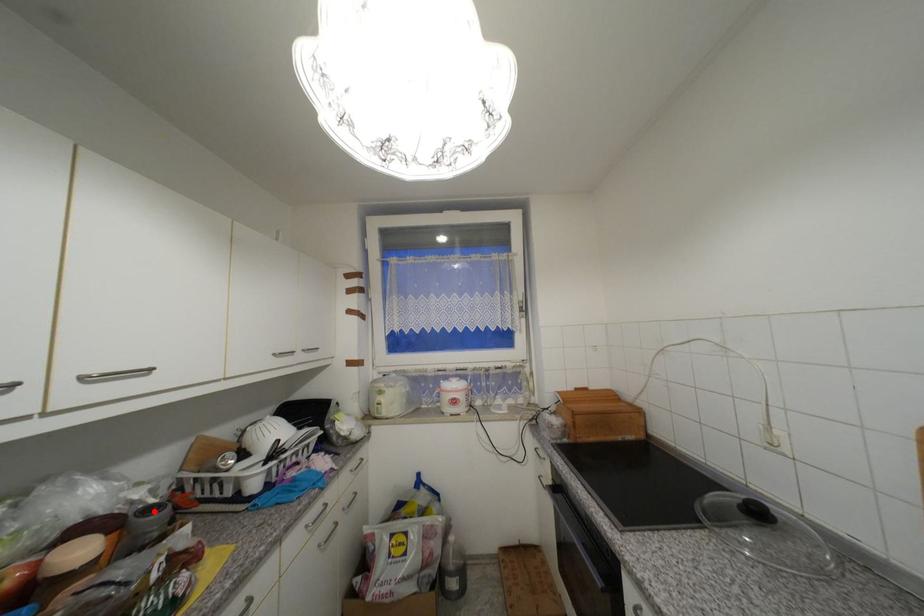
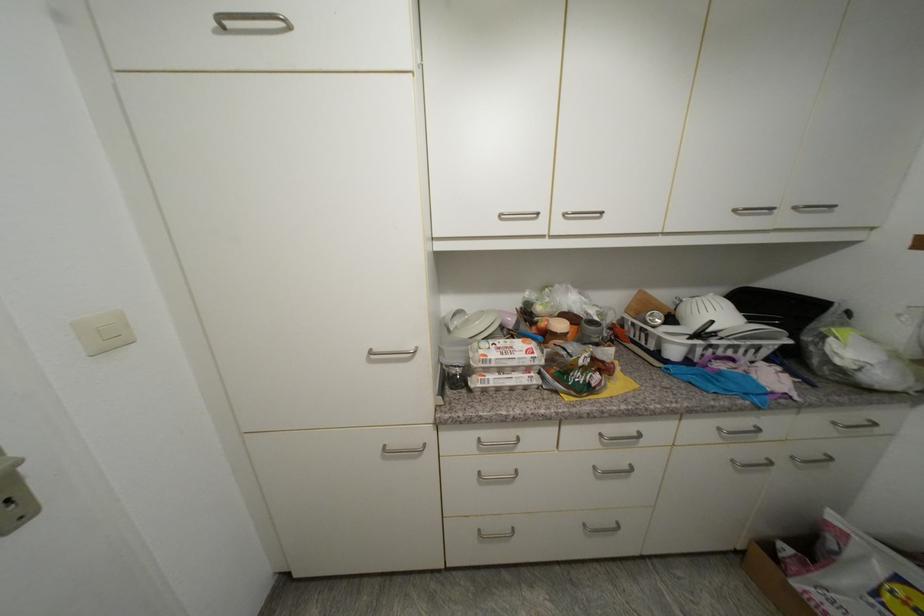
In the second image, find the point that corresponds to the highlighted location in the first image.

(598, 323)